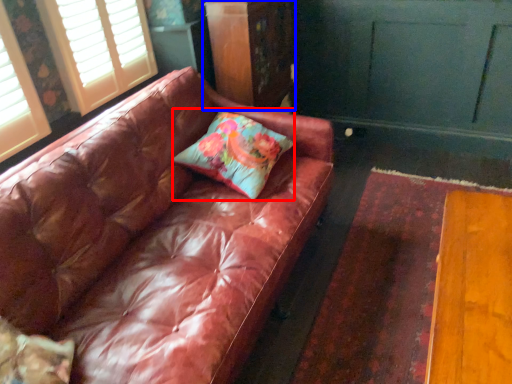
Question: Which object is further to the camera taking this photo, pillow (highlighted by a red box) or dresser (highlighted by a blue box)?

Choices:
 (A) pillow
 (B) dresser

Answer: (B)